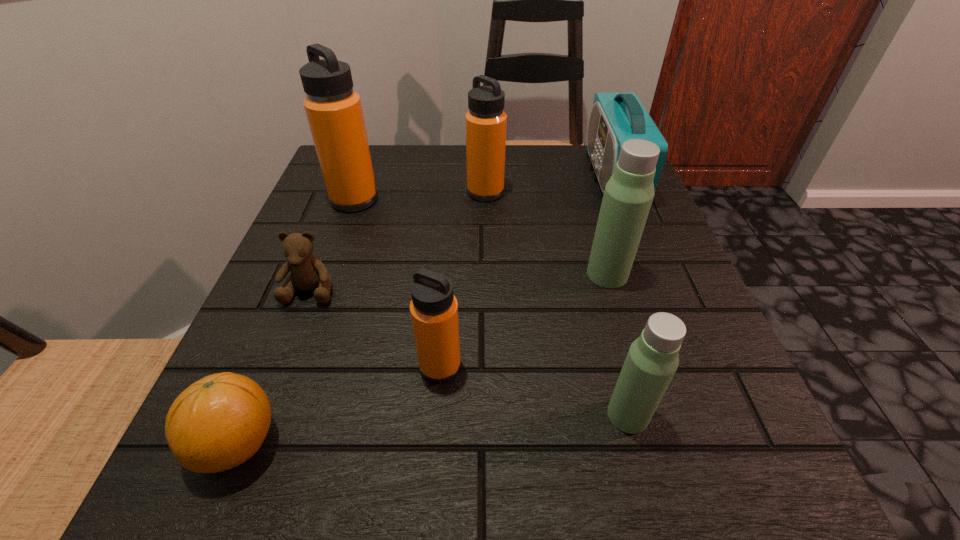
Locate an element on the screen. object present at the near left corner is located at coordinates (219, 422).

Identify the location of object positioned at the far right corner. The height and width of the screenshot is (540, 960). (615, 118).

Where is `free location at the far edge of the desktop`? The image size is (960, 540). free location at the far edge of the desktop is located at coordinates (428, 164).

This screenshot has width=960, height=540. What are the coordinates of `free space at the near edge of the desktop` in the screenshot? It's located at (486, 510).

Find the location of a particular element. Image resolution: width=960 pixels, height=540 pixels. vacant region at the left edge of the desktop is located at coordinates (335, 282).

This screenshot has width=960, height=540. What are the coordinates of `vacant space at the right edge of the desktop` in the screenshot? It's located at (660, 429).

Find the location of a particular element. Image resolution: width=960 pixels, height=540 pixels. vacant space at the near left corner of the desktop is located at coordinates (284, 485).

You are a GUI agent. You are given a task and a screenshot of the screen. Output one action in this format:
    pyautogui.click(x=<x>, y=<y>)
    Task: Click on the free space at the far right corner
    
    Given the screenshot: What is the action you would take?
    pyautogui.click(x=564, y=146)

In the image, there is a desktop. What are the coordinates of `vacant space at the near right corner` in the screenshot? It's located at (703, 488).

Find the location of a particular element. unoccupied area between the second smallest orange thermos bottle and the third farthest thermos bottle is located at coordinates (546, 233).